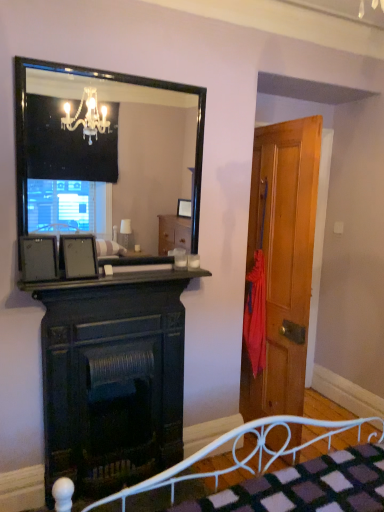
What is the approximate width of wooden door at right?

wooden door at right is 8.15 inches in width.

Identify the location of matte black picture frame at center, which is the 2th picture frame in left-to-right order. This screenshot has height=512, width=384. (78, 256).

Does matte black picture frame at left, arranged as the 2th picture frame when viewed from the right, appear on the left side of dark wood mantle at center?

Correct, you'll find matte black picture frame at left, arranged as the 2th picture frame when viewed from the right, to the left of dark wood mantle at center.

Is matte black picture frame at left, the 1th picture frame viewed from the left, beside dark wood mantle at center?

No, matte black picture frame at left, the 1th picture frame viewed from the left, is not with dark wood mantle at center.

Is point (45, 257) farther from viewer compared to point (144, 268)?

No.

Considering the positions of objects matte black picture frame at left, arranged as the 2th picture frame when viewed from the right, and dark wood mantle at center in the image provided, who is in front, matte black picture frame at left, arranged as the 2th picture frame when viewed from the right, or dark wood mantle at center?

Positioned in front is dark wood mantle at center.

Based on the photo, between dark wood mantle at center and matte black picture frame at center, which is the 2th picture frame in left-to-right order, which one has more height?

Standing taller between the two is matte black picture frame at center, which is the 2th picture frame in left-to-right order.

From a real-world perspective, who is located lower, dark wood mantle at center or matte black picture frame at center, the 1th picture frame from the right?

From a 3D spatial view, dark wood mantle at center is below.

Does point (174, 279) appear closer or farther from the camera than point (83, 265)?

Clearly, point (174, 279) is more distant from the camera than point (83, 265).

Considering the positions of objects dark wood mantle at center and matte black picture frame at center, which is the 2th picture frame in left-to-right order, in the image provided, who is more to the right, dark wood mantle at center or matte black picture frame at center, which is the 2th picture frame in left-to-right order,?

From the viewer's perspective, dark wood mantle at center appears more on the right side.

Does black glossy mirror at upper center have a greater width compared to matte black picture frame at center, which is the 2th picture frame in left-to-right order?

Incorrect, the width of black glossy mirror at upper center does not surpass that of matte black picture frame at center, which is the 2th picture frame in left-to-right order.

Can matte black picture frame at center, the 1th picture frame from the right, be found inside black glossy mirror at upper center?

Yes, black glossy mirror at upper center contains matte black picture frame at center, the 1th picture frame from the right.

Which is more to the right, black glossy mirror at upper center or matte black picture frame at center, which is the 2th picture frame in left-to-right order?

Positioned to the right is black glossy mirror at upper center.

From a real-world perspective, who is located lower, black glossy mirror at upper center or matte black picture frame at center, the 1th picture frame from the right?

matte black picture frame at center, the 1th picture frame from the right, from a real-world perspective.

From the image's perspective, is dark wood fireplace at center located beneath matte black picture frame at left, arranged as the 2th picture frame when viewed from the right?

Yes, from the image's perspective, dark wood fireplace at center is below matte black picture frame at left, arranged as the 2th picture frame when viewed from the right.

Is dark wood fireplace at center outside of matte black picture frame at left, arranged as the 2th picture frame when viewed from the right?

Yes, dark wood fireplace at center is located beyond the bounds of matte black picture frame at left, arranged as the 2th picture frame when viewed from the right.

Would you consider dark wood fireplace at center to be distant from matte black picture frame at left, the 1th picture frame viewed from the left?

No, there isn't a large distance between dark wood fireplace at center and matte black picture frame at left, the 1th picture frame viewed from the left.

In the image, is dark wood mantle at center on the left side or the right side of dark wood fireplace at center?

Clearly, dark wood mantle at center is on the right of dark wood fireplace at center in the image.

Considering the sizes of dark wood mantle at center and dark wood fireplace at center in the image, is dark wood mantle at center bigger or smaller than dark wood fireplace at center?

dark wood mantle at center is smaller than dark wood fireplace at center.

Does point (163, 281) lie in front of point (158, 294)?

Yes, it is.

Is the surface of white metal bed frame at lower center in direct contact with black glossy mirror at upper center?

They are not placed beside each other.

Is white metal bed frame at lower center oriented away from black glossy mirror at upper center?

No, black glossy mirror at upper center is not at the back of white metal bed frame at lower center.

From the image's perspective, is white metal bed frame at lower center located above black glossy mirror at upper center?

Incorrect, from the image's perspective, white metal bed frame at lower center is lower than black glossy mirror at upper center.

Between white metal bed frame at lower center and black glossy mirror at upper center, which one has less height?

Standing shorter between the two is white metal bed frame at lower center.

Measure the distance between dark wood fireplace at center and wooden door at right.

A distance of 32.23 inches exists between dark wood fireplace at center and wooden door at right.

From a real-world perspective, which object stands above the other?

From a 3D spatial view, wooden door at right is above.

What's the angular difference between dark wood fireplace at center and wooden door at right's facing directions?

The angle between the facing direction of dark wood fireplace at center and the facing direction of wooden door at right is 86.9 degrees.

Is dark wood fireplace at center positioned with its back to wooden door at right?

dark wood fireplace at center does not have its back to wooden door at right.

Locate an element on the screen. Image resolution: width=384 pixels, height=512 pixels. mantle on the right side of matte black picture frame at left, arranged as the 2th picture frame when viewed from the right is located at coordinates (119, 278).

Where is `the 1st picture frame counting from the left of the dark wood mantle at center`? This screenshot has width=384, height=512. the 1st picture frame counting from the left of the dark wood mantle at center is located at coordinates (78, 256).

When comparing their distances from dark wood mantle at center, does dark wood fireplace at center or matte black picture frame at left, arranged as the 2th picture frame when viewed from the right, seem further?

dark wood fireplace at center lies further to dark wood mantle at center than the other object.

Estimate the real-world distances between objects in this image. Which object is further from dark wood fireplace at center, dark wood mantle at center or wooden door at right?

The object further to dark wood fireplace at center is wooden door at right.

When comparing their distances from wooden door at right, does dark wood mantle at center or dark wood fireplace at center seem further?

Based on the image, dark wood fireplace at center appears to be further to wooden door at right.

When comparing their distances from white metal bed frame at lower center, does matte black picture frame at center, the 1th picture frame from the right, or black glossy mirror at upper center seem further?

Among the two, black glossy mirror at upper center is located further to white metal bed frame at lower center.

Considering their positions, is matte black picture frame at center, the 1th picture frame from the right, positioned further to dark wood fireplace at center than dark wood mantle at center?

Based on the image, matte black picture frame at center, the 1th picture frame from the right, appears to be further to dark wood fireplace at center.

Based on their spatial positions, is matte black picture frame at left, the 1th picture frame viewed from the left, or wooden door at right closer to dark wood fireplace at center?

matte black picture frame at left, the 1th picture frame viewed from the left, is closer to dark wood fireplace at center.

When comparing their distances from white metal bed frame at lower center, does dark wood mantle at center or black glossy mirror at upper center seem closer?

Based on the image, dark wood mantle at center appears to be nearer to white metal bed frame at lower center.

Which object lies further to the anchor point dark wood fireplace at center, matte black picture frame at left, the 1th picture frame viewed from the left, or black glossy mirror at upper center?

Based on the image, black glossy mirror at upper center appears to be further to dark wood fireplace at center.

Locate an element on the screen. The height and width of the screenshot is (512, 384). mantle between matte black picture frame at center, which is the 2th picture frame in left-to-right order, and white metal bed frame at lower center in the up-down direction is located at coordinates pyautogui.click(x=119, y=278).

Locate an element on the screen. bed frame located between matte black picture frame at left, the 1th picture frame viewed from the left, and wooden door at right in the left-right direction is located at coordinates (236, 454).

Locate an element on the screen. The height and width of the screenshot is (512, 384). picture frame between matte black picture frame at left, the 1th picture frame viewed from the left, and white metal bed frame at lower center is located at coordinates (78, 256).

Find the location of a particular element. fireplace between matte black picture frame at center, the 1th picture frame from the right, and wooden door at right from left to right is located at coordinates (112, 378).